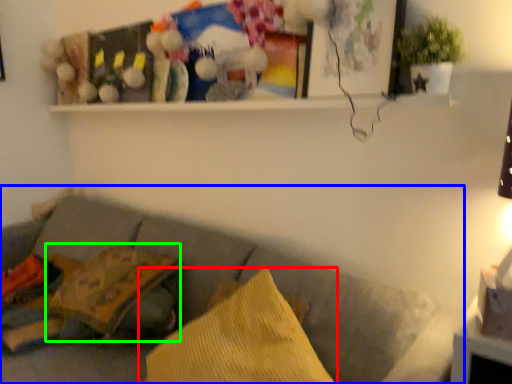
Question: Which is farther away from pillow (highlighted by a red box)? studio couch (highlighted by a blue box) or pillow (highlighted by a green box)?

Choices:
 (A) studio couch
 (B) pillow

Answer: (B)